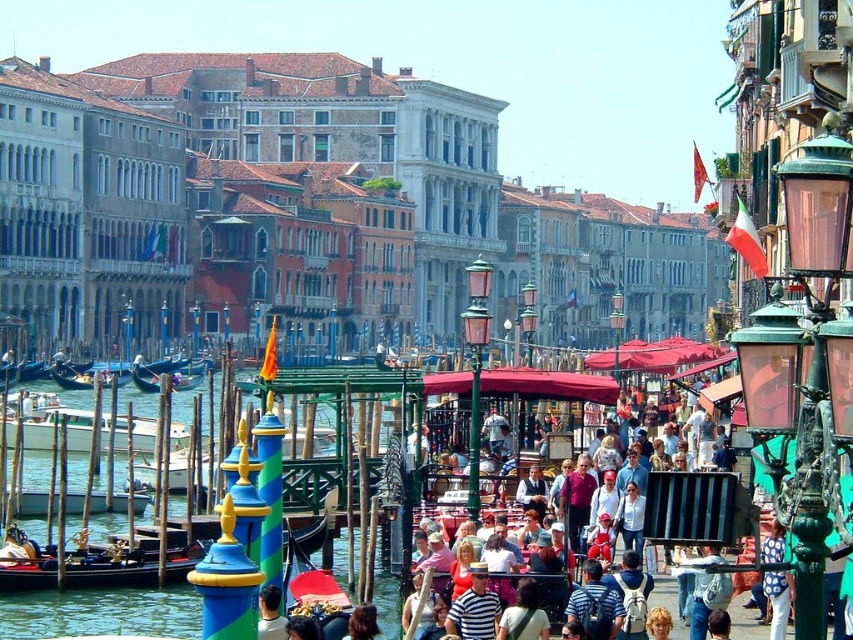
You are a tourist standing at the center of the Grand Canal in Venice. You want to take a photo of the wooden gondola at left. Where should you position yourself to capture it in your shot?

To capture the wooden gondola at left in your photo, position yourself at the center of the Grand Canal since the wooden gondola at left is located at coordinate point (88, 376), which is within the visible range from the center.

You are a tourist planning to take a boat ride on the Grand Canal in Venice. You see the black polished wood gondola at lower left and the white wooden boat at center. Which boat is narrower? Please choose between the two.

The black polished wood gondola at lower left is narrower than the white wooden boat at center.

You are standing at the point with coordinates (57, 426) on the image. What object is exactly at your current location?

The white wooden boat at center is exactly at the point (57, 426).